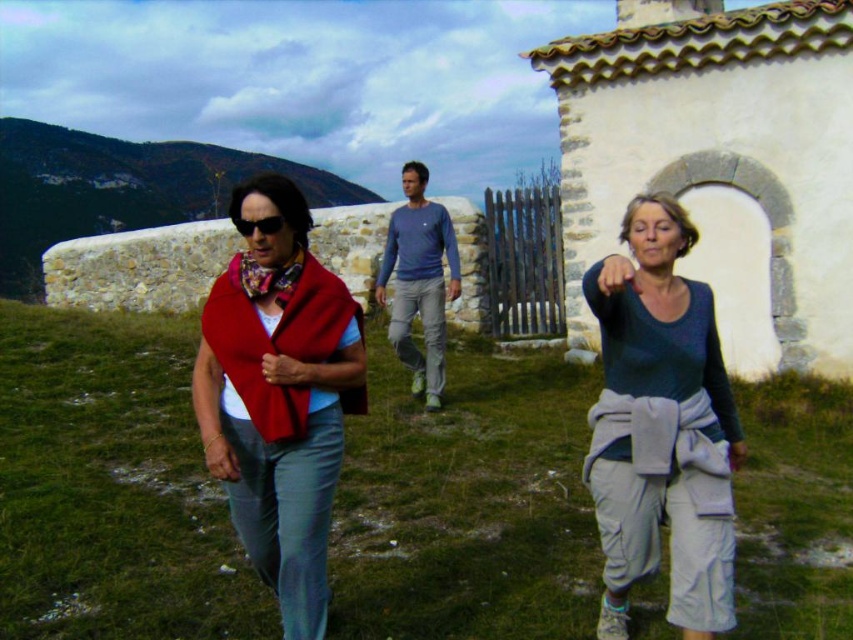
You are a photographer trying to capture a photo of the blue cotton shirt at center and the floral silk scarf at center. Which object should you focus on first to ensure both are in the frame?

You should focus on the blue cotton shirt at center first because it is closer to you than the floral silk scarf at center, ensuring both are in the frame.

In the scene shown: You are standing in the rural setting shown in the image and need to determine which of the two points, point (726, 627) or point (277, 224), is closer to you. Based on the scene, which point is nearer?

Point (726, 627) is closer to the viewer than point (277, 224).

You are a photographer trying to capture a group photo of the teal matte shirt at center and the black reflective sunglasses at center. If you want to ensure both are fully visible in the frame, which object should you focus on to avoid cropping?

The teal matte shirt at center is wider than the black reflective sunglasses at center, so focusing on the teal matte shirt at center would ensure both are fully visible without cropping.